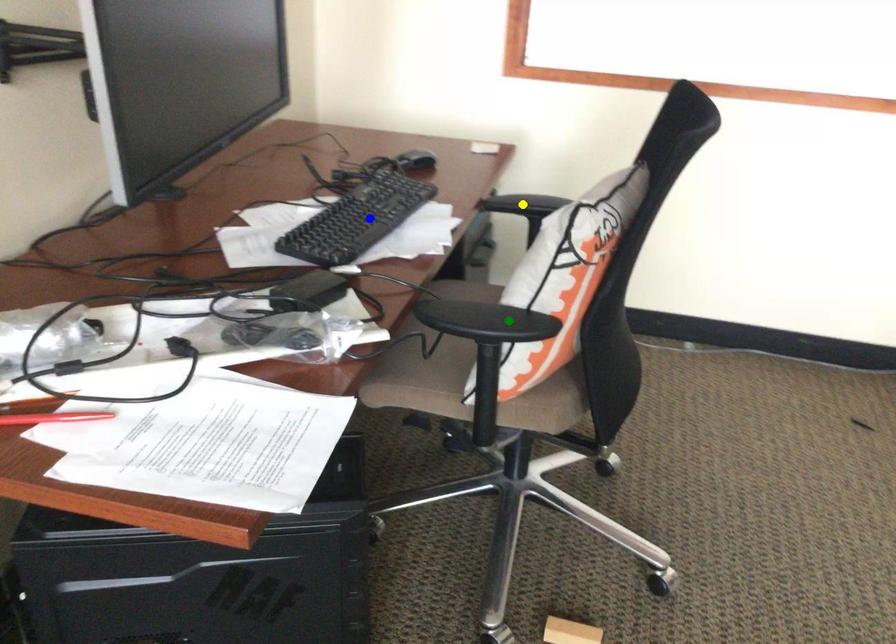
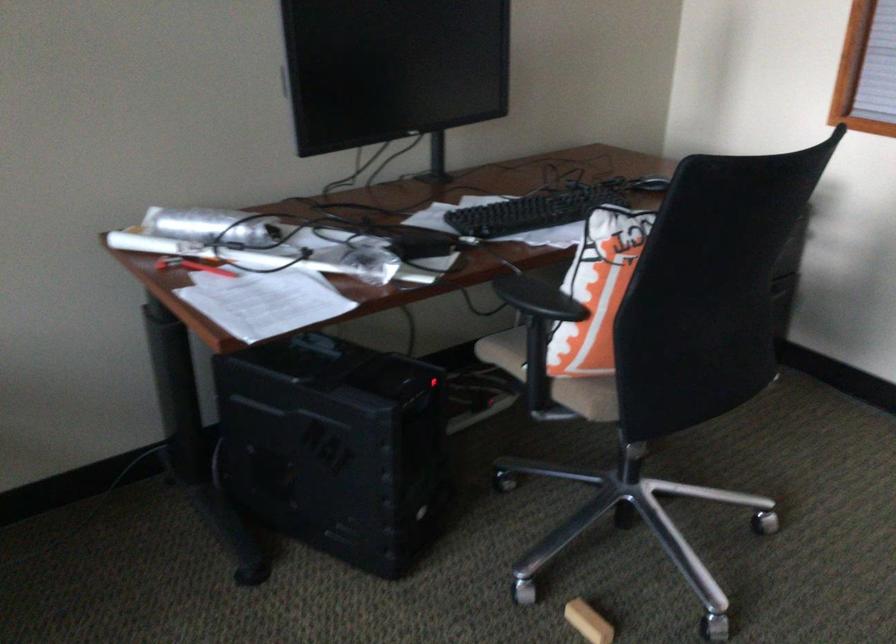
I am providing you with two images of the same scene from different viewpoints. Three points are marked in image1. Which point corresponds to a part or object that is occluded in image2?In image1, three points are marked. Which of them correspond to a part or object that is occluded in image2?Among the three points shown in image1, which one corresponds to a part or object that is no longer visible due to occlusion in image2?

yellow point